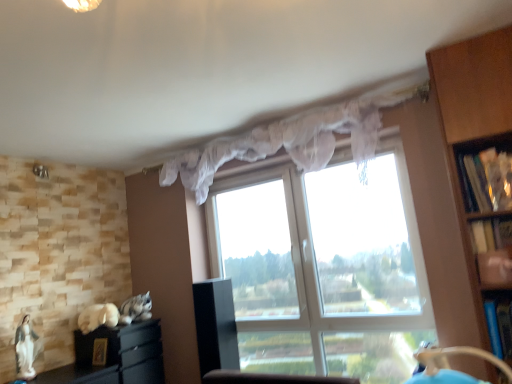
Question: From the image's perspective, is black glossy cabinet at center, the second cabinetry in the left-to-right sequence, on top of wooden bookshelf at right, the second shelf from the bottom?

Choices:
 (A) yes
 (B) no

Answer: (B)

Question: From a real-world perspective, is black glossy cabinet at center, the first cabinetry positioned from the right, below wooden bookshelf at right, the second shelf from the bottom?

Choices:
 (A) no
 (B) yes

Answer: (B)

Question: Is black glossy cabinet at center, the second cabinetry in the left-to-right sequence, at the right side of wooden bookshelf at right, the second shelf from the bottom?

Choices:
 (A) no
 (B) yes

Answer: (A)

Question: Considering the relative sizes of black glossy cabinet at center, the first cabinetry positioned from the right, and wooden bookshelf at right, the second shelf from the bottom, in the image provided, is black glossy cabinet at center, the first cabinetry positioned from the right, bigger than wooden bookshelf at right, the second shelf from the bottom,?

Choices:
 (A) no
 (B) yes

Answer: (B)

Question: Could you tell me if black glossy cabinet at center, the second cabinetry in the left-to-right sequence, is facing wooden bookshelf at right, the second shelf from the bottom?

Choices:
 (A) no
 (B) yes

Answer: (A)

Question: From the image's perspective, is blue plastic shelf at right, positioned as the third shelf in top-to-bottom order, located above or below black matte cabinet at lower left, the 1th cabinetry from the left?

Choices:
 (A) above
 (B) below

Answer: (A)

Question: Considering their positions, is blue plastic shelf at right, positioned as the third shelf in top-to-bottom order, located in front of or behind black matte cabinet at lower left, the 1th cabinetry from the left?

Choices:
 (A) behind
 (B) front

Answer: (B)

Question: From a real-world perspective, relative to black matte cabinet at lower left, the 2th cabinetry from the right, is blue plastic shelf at right, positioned as the third shelf in top-to-bottom order, vertically above or below?

Choices:
 (A) below
 (B) above

Answer: (B)

Question: Considering the positions of blue plastic shelf at right, positioned as the third shelf in top-to-bottom order, and black matte cabinet at lower left, the 2th cabinetry from the right, in the image, is blue plastic shelf at right, positioned as the third shelf in top-to-bottom order, wider or thinner than black matte cabinet at lower left, the 2th cabinetry from the right,?

Choices:
 (A) thin
 (B) wide

Answer: (A)

Question: In the image, is black glossy cabinet at center, the second cabinetry in the left-to-right sequence, positioned in front of or behind translucent fabric curtain at upper center?

Choices:
 (A) front
 (B) behind

Answer: (B)

Question: Choose the correct answer: Is black glossy cabinet at center, the second cabinetry in the left-to-right sequence, inside translucent fabric curtain at upper center or outside it?

Choices:
 (A) outside
 (B) inside

Answer: (A)

Question: Visually, is black glossy cabinet at center, the first cabinetry positioned from the right, positioned to the left or to the right of translucent fabric curtain at upper center?

Choices:
 (A) right
 (B) left

Answer: (B)

Question: Considering the positions of point (217, 307) and point (351, 112), is point (217, 307) closer or farther from the camera than point (351, 112)?

Choices:
 (A) closer
 (B) farther

Answer: (B)

Question: Looking at their shapes, would you say black matte cabinet at lower left, the 1th cabinetry from the left, is wider or thinner than blue plastic shelf at right, which is counted as the 1th shelf, starting from the bottom?

Choices:
 (A) wide
 (B) thin

Answer: (A)

Question: From a real-world perspective, relative to blue plastic shelf at right, positioned as the third shelf in top-to-bottom order, is black matte cabinet at lower left, the 2th cabinetry from the right, vertically above or below?

Choices:
 (A) below
 (B) above

Answer: (A)